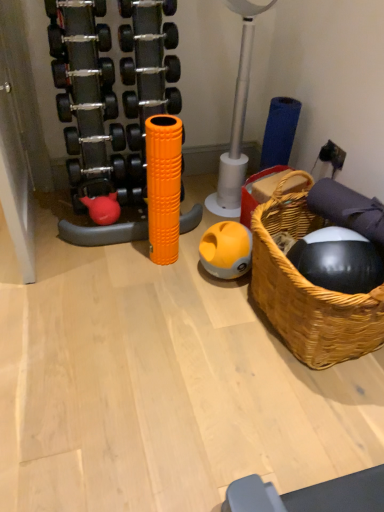
This screenshot has width=384, height=512. What are the coordinates of `free space in front of yellow matte ball at center` in the screenshot? It's located at (223, 304).